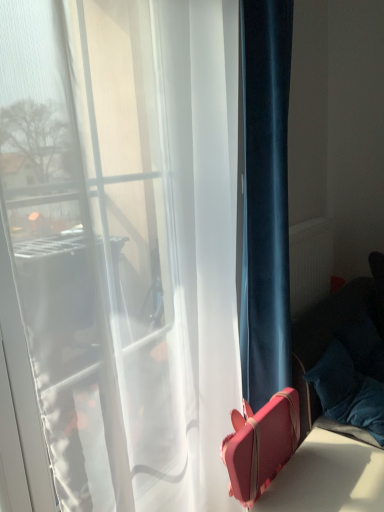
Question: In the image, is matte white radiator at right on the left side or the right side of velvet blue curtain at right?

Choices:
 (A) left
 (B) right

Answer: (B)

Question: Looking at their shapes, would you say matte white radiator at right is wider or thinner than velvet blue curtain at right?

Choices:
 (A) thin
 (B) wide

Answer: (A)

Question: Which of these objects is positioned farthest from the velvety blue pillow at lower right?

Choices:
 (A) velvet blue curtain at right
 (B) matte white radiator at right
 (C) pink leather suitcase at lower right

Answer: (B)

Question: Considering the real-world distances, which object is farthest from the pink leather suitcase at lower right?

Choices:
 (A) velvety blue pillow at lower right
 (B) velvet blue curtain at right
 (C) matte white radiator at right

Answer: (C)